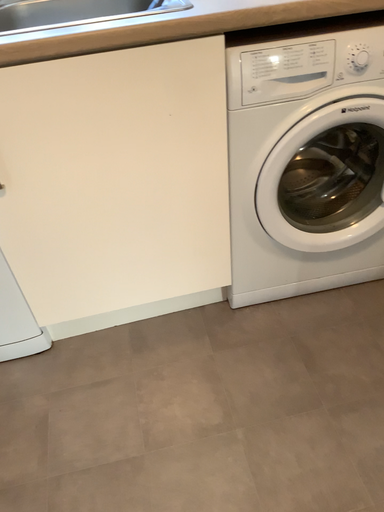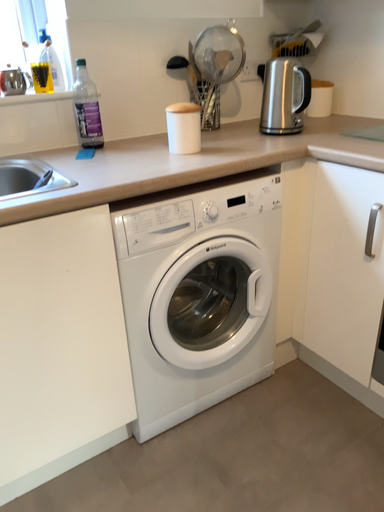
Question: Which way did the camera rotate in the video?

Choices:
 (A) rotated downward
 (B) rotated upward

Answer: (B)